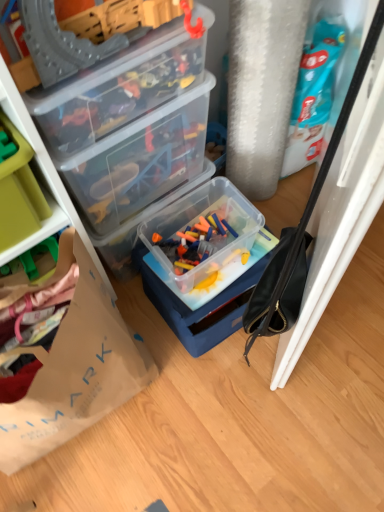
Find the location of a particular element. empty space that is to the right of brown paper bag at lower left is located at coordinates tap(196, 420).